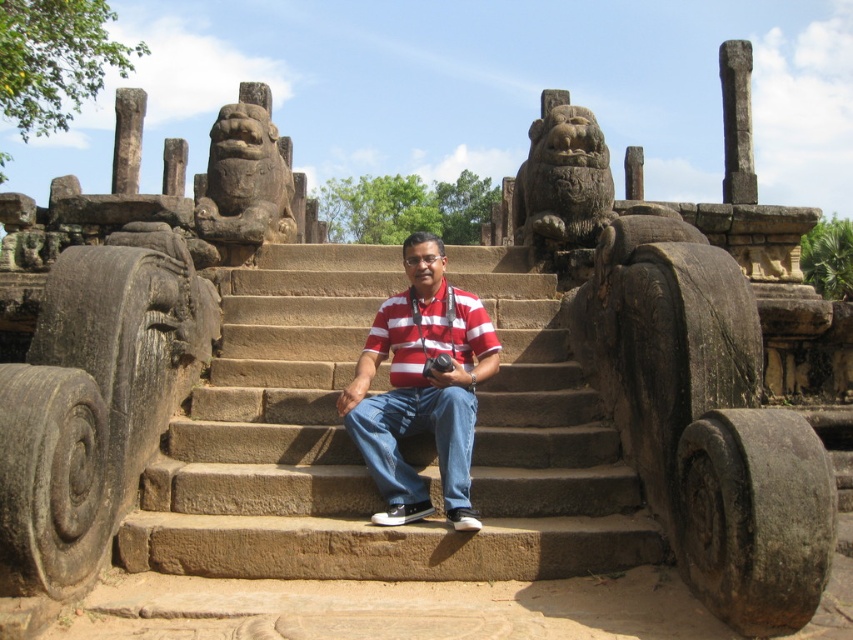
Question: Can you confirm if red striped shirt at center is positioned to the right of dark brown stone lion at upper left?

Choices:
 (A) yes
 (B) no

Answer: (A)

Question: Which object is closer to the camera taking this photo?

Choices:
 (A) dark brown stone lion at upper left
 (B) red striped shirt at center
 (C) red striped polo shirt at center

Answer: (B)

Question: Which is nearer to the dark brown stone lion at upper left?

Choices:
 (A) red striped shirt at center
 (B) red striped polo shirt at center

Answer: (B)

Question: Which object appears farthest from the camera in this image?

Choices:
 (A) red striped polo shirt at center
 (B) dark brown stone lion at upper left
 (C) red striped shirt at center

Answer: (B)

Question: Can you confirm if red striped shirt at center is smaller than red striped polo shirt at center?

Choices:
 (A) yes
 (B) no

Answer: (B)

Question: Does brown stone stairs at center lie behind dark brown stone lion at upper left?

Choices:
 (A) yes
 (B) no

Answer: (B)